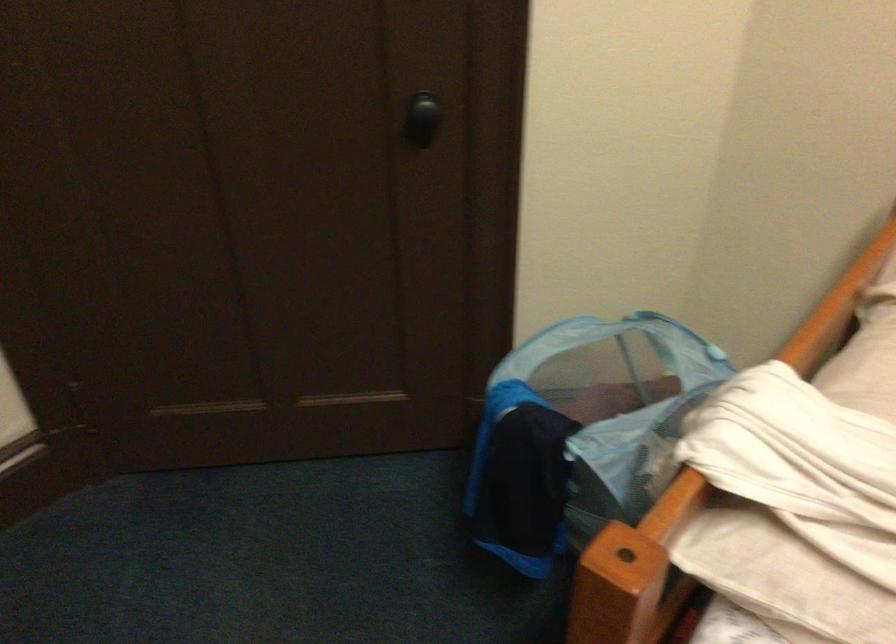
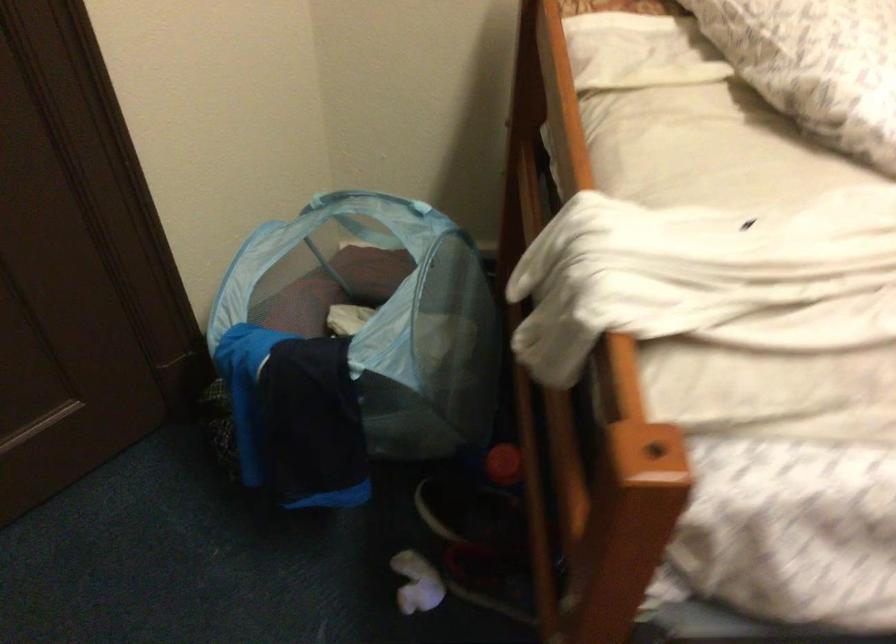
Looking at this image, how did the camera likely rotate?

The camera's rotation is toward right-down.